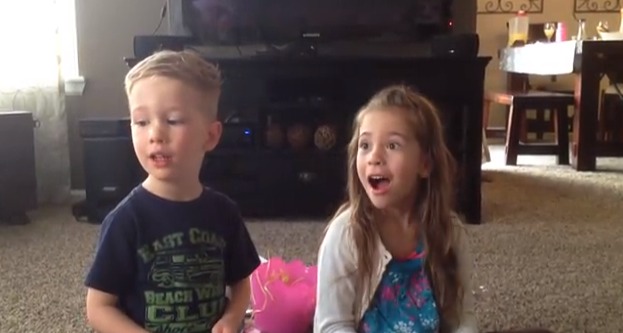
At what (x,y) coordinates should I click in order to perform the action: click on floor. Please return your answer as a coordinate pair (x, y). Looking at the image, I should click on (546, 245).